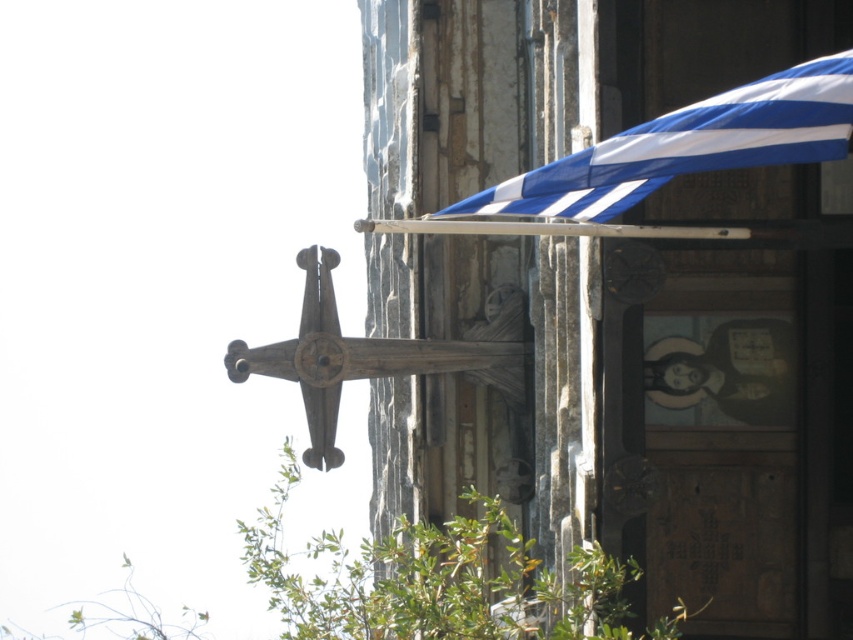
You are standing in front of the stone building and want to hang a new decoration between the blue striped awning at upper right and the wooden cross at center. Based on their positions, which object should you place your decoration closer to in order to maintain a balanced look?

The blue striped awning at upper right is closer to the viewer than the wooden cross at center, so placing the decoration closer to the wooden cross at center would help maintain a balanced look by accounting for the difference in depth.

You are standing in front of the stone building with the wooden cross and the blue striped awning at upper right. If you want to reach the awning, should you move to your left or right?

The blue striped awning at upper right is located at point 0.230 on the x axis, which is to the left side of the image. Therefore, you should move to your left to reach it.

You are an architect assessing the structural integrity of the building. You notice the blue striped awning at upper right and the wooden cross at center. Which object is positioned higher up in the image?

The blue striped awning at upper right is above the wooden cross at center, so it is positioned higher up in the image.